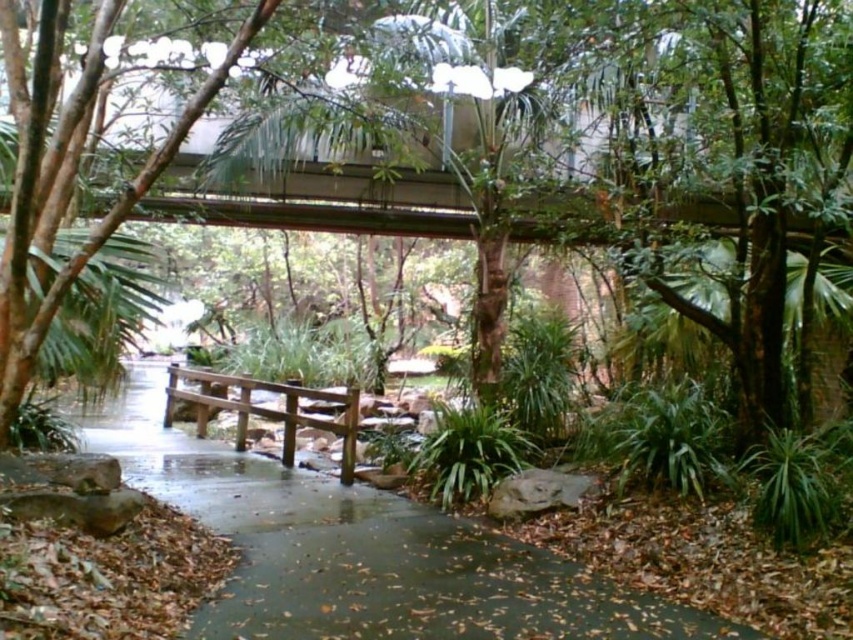
Question: Estimate the real-world distances between objects in this image. Which object is farther from the green leafy tree at center?

Choices:
 (A) brown wooden bench at center
 (B) brown wooden bridge at center

Answer: (A)

Question: Among these objects, which one is nearest to the camera?

Choices:
 (A) brown wooden bridge at center
 (B) green leafy tree at center
 (C) brown wooden bench at center

Answer: (B)

Question: Does green leafy tree at center have a smaller size compared to brown wooden bridge at center?

Choices:
 (A) yes
 (B) no

Answer: (B)

Question: Among these points, which one is farthest from the camera?

Choices:
 (A) (444, 593)
 (B) (532, 216)

Answer: (B)

Question: Is brown wooden bridge at center to the right of brown wooden bench at center from the viewer's perspective?

Choices:
 (A) yes
 (B) no

Answer: (A)

Question: Is green leafy tree at center to the right of brown wooden bridge at center from the viewer's perspective?

Choices:
 (A) yes
 (B) no

Answer: (A)